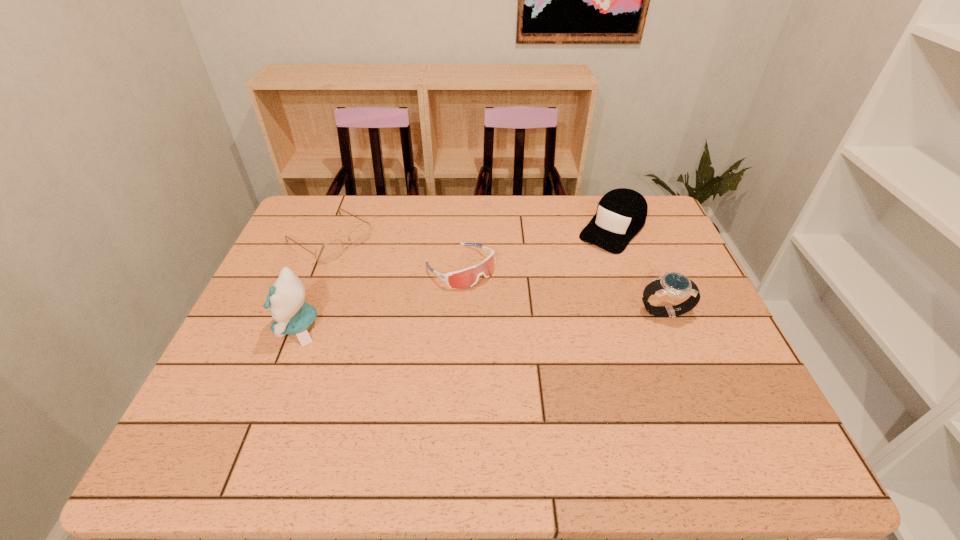
Identify the location of the closest object relative to the tallest object. (327, 252).

Where is `vacant space that satisfies the following two spatial constraints: 1. on the front side of the fourth tallest object; 2. on the right side of the spectacles`? vacant space that satisfies the following two spatial constraints: 1. on the front side of the fourth tallest object; 2. on the right side of the spectacles is located at coordinates (319, 266).

The width and height of the screenshot is (960, 540). In order to click on free space in the image that satisfies the following two spatial constraints: 1. on the front side of the watch; 2. on the right side of the cap in this screenshot , I will do click(642, 311).

In order to click on free space that satisfies the following two spatial constraints: 1. on the front side of the spectacles; 2. on the right side of the watch in this screenshot , I will do `click(300, 311)`.